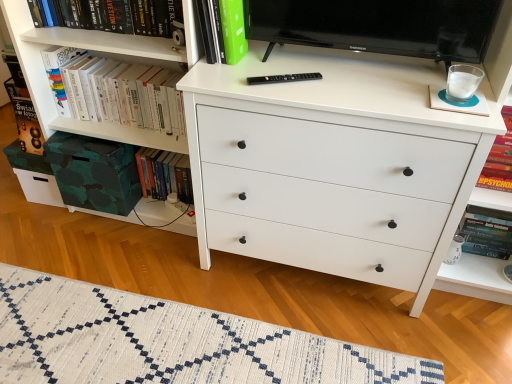
This screenshot has width=512, height=384. In order to click on free space in front of black glossy television at upper center in this screenshot , I will do `click(367, 94)`.